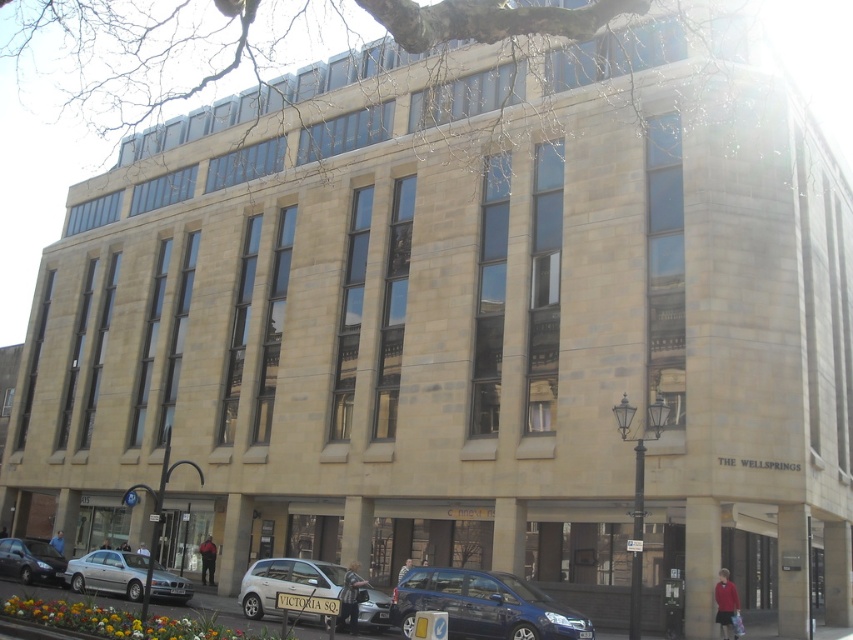
Between point (583, 620) and point (39, 541), which one is positioned behind?

The point (39, 541) is more distant.

Is point (469, 580) behind point (10, 568)?

That is False.

At what (x,y) coordinates should I click in order to perform the action: click on metallic blue van at lower center. Please return your answer as a coordinate pair (x, y). This screenshot has height=640, width=853. Looking at the image, I should click on (485, 605).

Is silver metallic hatchback at lower center closer to camera compared to silver metallic sedan at lower left?

Yes, silver metallic hatchback at lower center is in front of silver metallic sedan at lower left.

Looking at this image, does silver metallic hatchback at lower center appear under silver metallic sedan at lower left?

Incorrect, silver metallic hatchback at lower center is not positioned below silver metallic sedan at lower left.

Which is behind, point (268, 605) or point (105, 557)?

The point (105, 557) is behind.

This screenshot has height=640, width=853. I want to click on silver metallic hatchback at lower center, so (x=286, y=582).

Does metallic blue van at lower center have a greater height compared to silver metallic hatchback at lower center?

In fact, metallic blue van at lower center may be shorter than silver metallic hatchback at lower center.

Is point (393, 616) in front of point (363, 596)?

Yes, it is in front of point (363, 596).

Which is in front, point (531, 588) or point (256, 580)?

Point (531, 588)

This screenshot has width=853, height=640. In order to click on metallic blue van at lower center in this screenshot , I will do `click(485, 605)`.